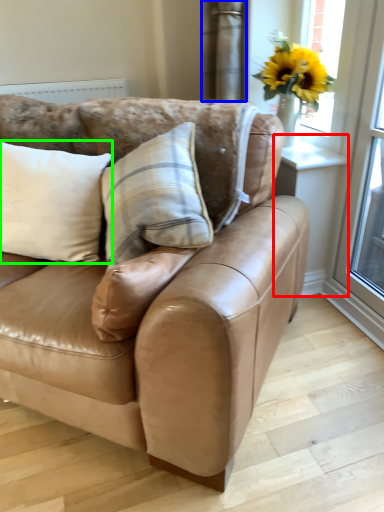
Question: Estimate the real-world distances between objects in this image. Which object is closer to window (highlighted by a red box), curtain (highlighted by a blue box) or pillow (highlighted by a green box)?

Choices:
 (A) curtain
 (B) pillow

Answer: (A)